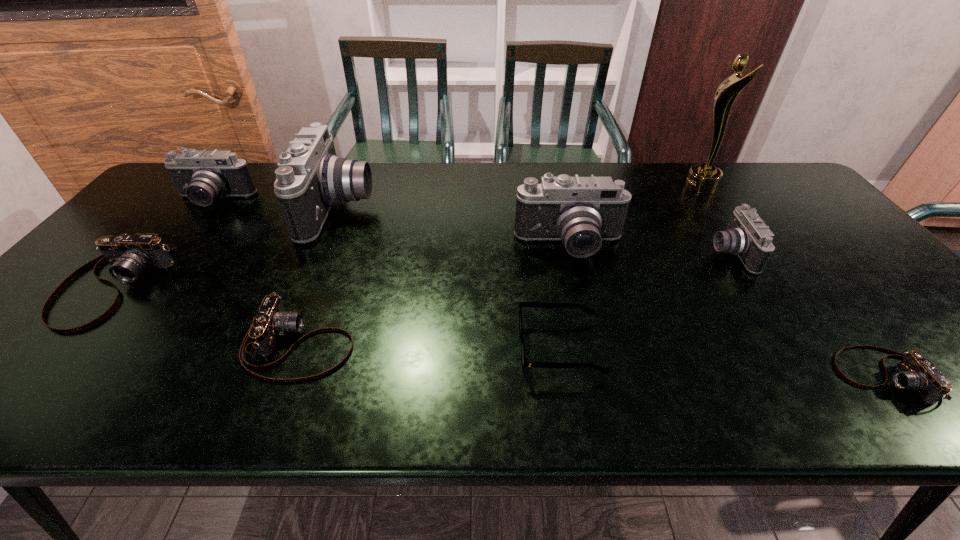
Where is `empty space that is in between the second brown camera from left to right and the shortest camera`? empty space that is in between the second brown camera from left to right and the shortest camera is located at coordinates (591, 360).

Select which object appears as the fourth closest to the third shortest camera. Please provide its 2D coordinates. Your answer should be formatted as a tuple, i.e. [(x, y)], where the tuple contains the x and y coordinates of a point satisfying the conditions above.

[(589, 311)]

Select which object is the closest to the rightmost black camera. Please provide its 2D coordinates. Your answer should be formatted as a tuple, i.e. [(x, y)], where the tuple contains the x and y coordinates of a point satisfying the conditions above.

[(702, 178)]

The height and width of the screenshot is (540, 960). In order to click on camera that can be found as the fourth closest to the tallest camera in this screenshot , I will do `click(581, 211)`.

In order to click on camera that stands as the sixth closest to the biggest black camera in this screenshot , I will do `click(915, 372)`.

This screenshot has width=960, height=540. Identify the location of black camera object that ranks as the third closest to the fifth shortest object. (203, 176).

This screenshot has height=540, width=960. In order to click on black camera that is the third closest one to the black spectacles in this screenshot , I will do `click(311, 179)`.

What are the coordinates of `brown camera that is the second closest to the second smallest brown camera` in the screenshot? It's located at (915, 372).

Select which brown camera is the closest to the third tallest object. Please provide its 2D coordinates. Your answer should be formatted as a tuple, i.e. [(x, y)], where the tuple contains the x and y coordinates of a point satisfying the conditions above.

[(272, 320)]

You are a GUI agent. You are given a task and a screenshot of the screen. Output one action in this format:
    pyautogui.click(x=<x>, y=<y>)
    Task: Click on the vacant space that satisfies the following two spatial constraints: 1. on the front-facing side of the biggest black camera; 2. on the front-facing side of the leftmost brown camera
    This screenshot has height=540, width=960.
    Given the screenshot: What is the action you would take?
    (x=308, y=286)